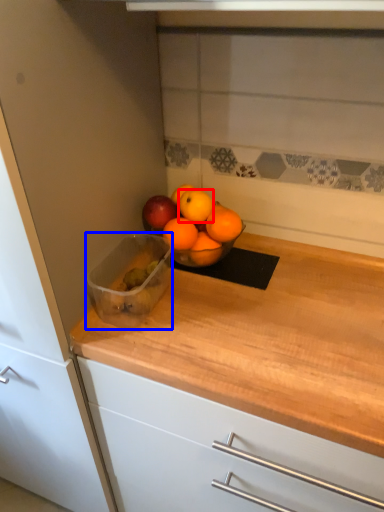
Question: Which point is further to the camera, orange (highlighted by a red box) or glass bowl (highlighted by a blue box)?

Choices:
 (A) orange
 (B) glass bowl

Answer: (A)